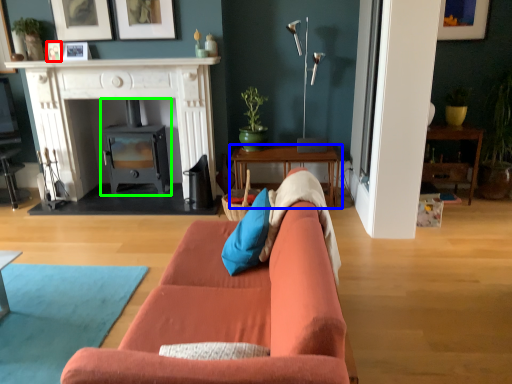
Question: Which object is positioned farthest from picture frame (highlighted by a red box)? Select from table (highlighted by a blue box) and wood burning stove (highlighted by a green box).

Choices:
 (A) table
 (B) wood burning stove

Answer: (A)